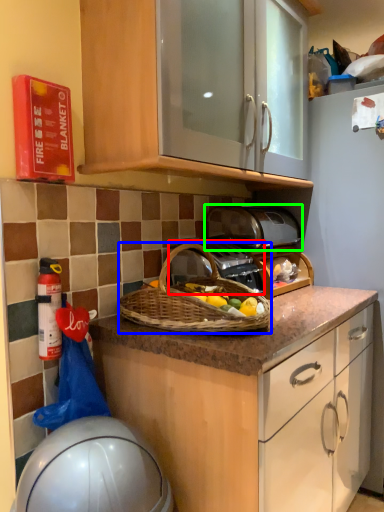
Question: Which object is positioned farthest from gas stove (highlighted by a red box)? Select from picnic basket (highlighted by a blue box) and toaster (highlighted by a green box).

Choices:
 (A) picnic basket
 (B) toaster

Answer: (B)